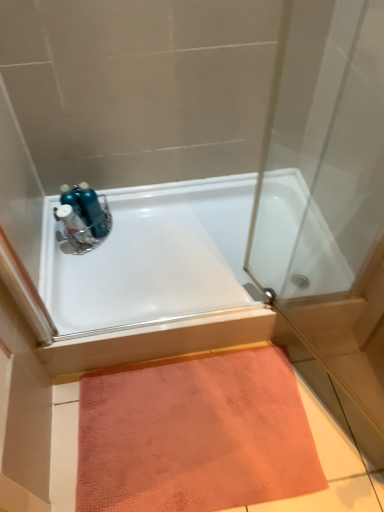
Question: Is blue metallic bottles at upper left to the right of metallic blue sink at upper left from the viewer's perspective?

Choices:
 (A) yes
 (B) no

Answer: (A)

Question: Is blue metallic bottles at upper left closer to camera compared to metallic blue sink at upper left?

Choices:
 (A) yes
 (B) no

Answer: (B)

Question: Can you confirm if blue metallic bottles at upper left is smaller than metallic blue sink at upper left?

Choices:
 (A) no
 (B) yes

Answer: (A)

Question: Is blue metallic bottles at upper left touching metallic blue sink at upper left?

Choices:
 (A) yes
 (B) no

Answer: (A)

Question: Can you confirm if blue metallic bottles at upper left is wider than metallic blue sink at upper left?

Choices:
 (A) no
 (B) yes

Answer: (B)

Question: Is white glossy bathtub at upper center wider or thinner than blue metallic bottles at upper left?

Choices:
 (A) wide
 (B) thin

Answer: (A)

Question: Considering the positions of point (49, 228) and point (94, 228), is point (49, 228) closer or farther from the camera than point (94, 228)?

Choices:
 (A) closer
 (B) farther

Answer: (A)

Question: From a real-world perspective, is white glossy bathtub at upper center physically located above or below blue metallic bottles at upper left?

Choices:
 (A) above
 (B) below

Answer: (B)

Question: Is white glossy bathtub at upper center taller or shorter than blue metallic bottles at upper left?

Choices:
 (A) tall
 (B) short

Answer: (B)

Question: Based on their positions, is metallic blue sink at upper left located to the left or right of blue metallic bottles at upper left?

Choices:
 (A) right
 (B) left

Answer: (B)

Question: Considering the positions of metallic blue sink at upper left and blue metallic bottles at upper left in the image, is metallic blue sink at upper left wider or thinner than blue metallic bottles at upper left?

Choices:
 (A) thin
 (B) wide

Answer: (A)

Question: Looking at the image, does metallic blue sink at upper left seem bigger or smaller compared to blue metallic bottles at upper left?

Choices:
 (A) small
 (B) big

Answer: (A)

Question: From a real-world perspective, relative to blue metallic bottles at upper left, is metallic blue sink at upper left vertically above or below?

Choices:
 (A) below
 (B) above

Answer: (B)

Question: Considering their positions, is metallic blue sink at upper left located in front of or behind white glossy bathtub at upper center?

Choices:
 (A) front
 (B) behind

Answer: (B)

Question: In terms of height, does metallic blue sink at upper left look taller or shorter compared to white glossy bathtub at upper center?

Choices:
 (A) short
 (B) tall

Answer: (B)